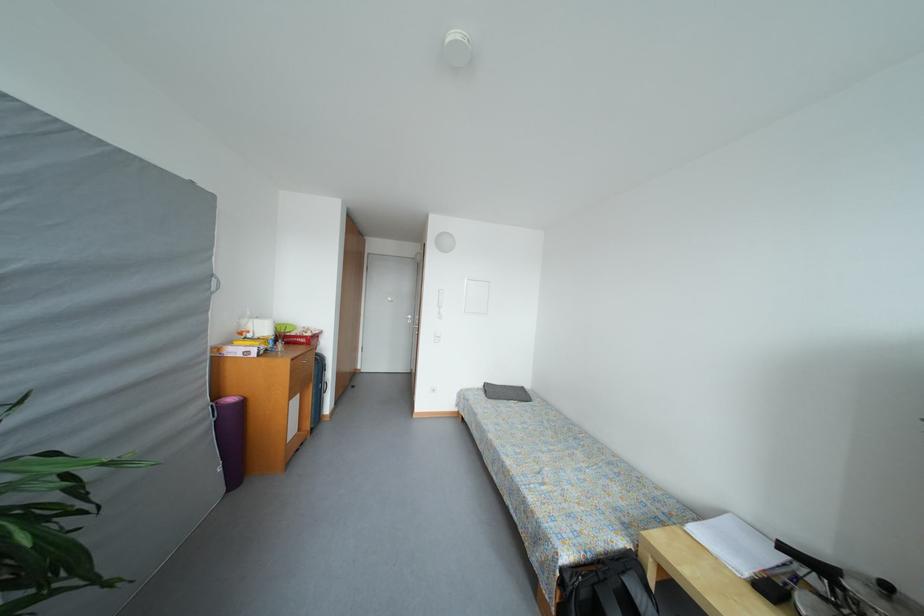
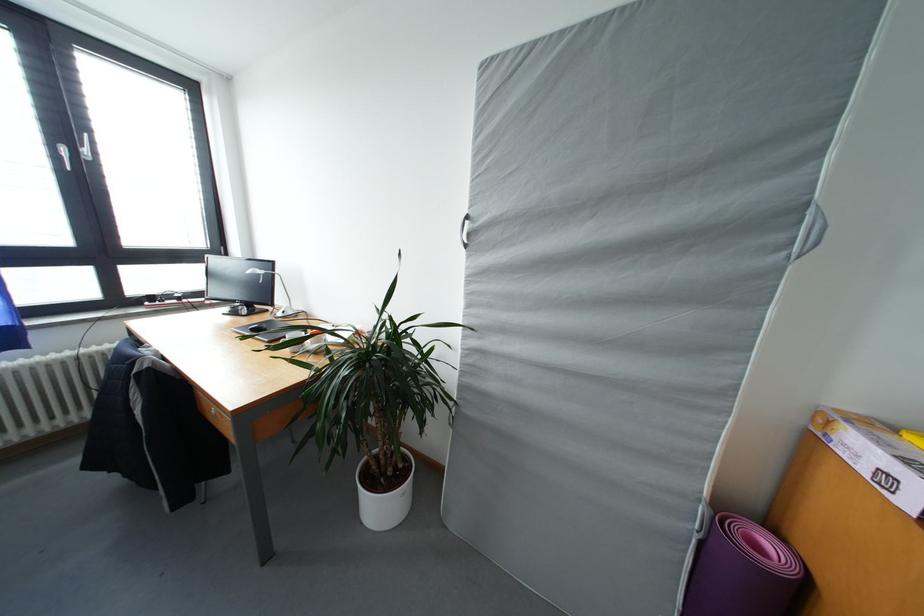
In the second image, find the point that corresponds to pixel 241 355 in the first image.

(868, 455)